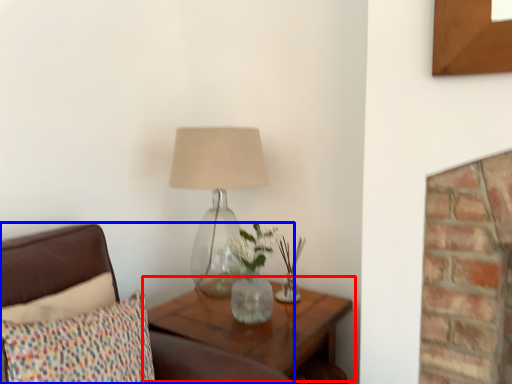
Question: Among these objects, which one is farthest to the camera, table (highlighted by a red box) or furniture (highlighted by a blue box)?

Choices:
 (A) table
 (B) furniture

Answer: (A)